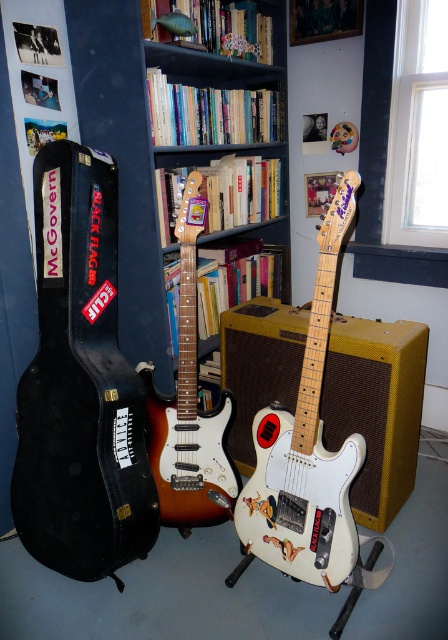
You are a GUI agent. You are given a task and a screenshot of the screen. Output one action in this format:
    pyautogui.click(x=<x>, y=<y>)
    Task: Click on the wooden bookcase at center
    
    Given the screenshot: What is the action you would take?
    pyautogui.click(x=151, y=145)

Is black matte guitar case at left shorter than wooden bookcase at center?

Indeed, black matte guitar case at left has a lesser height compared to wooden bookcase at center.

Which is behind, point (124, 460) or point (199, 152)?

Point (199, 152)

Find the location of a particular element. The height and width of the screenshot is (640, 448). black matte guitar case at left is located at coordinates (80, 385).

What are the coordinates of `black matte guitar case at left` in the screenshot? It's located at (80, 385).

Is black matte guitar case at left below sunburst wood electric guitar at center?

Indeed, black matte guitar case at left is positioned under sunburst wood electric guitar at center.

Between black matte guitar case at left and sunburst wood electric guitar at center, which one appears on the right side from the viewer's perspective?

Positioned to the right is sunburst wood electric guitar at center.

Does point (34, 230) come behind point (193, 518)?

No, it is not.

The height and width of the screenshot is (640, 448). What are the coordinates of `black matte guitar case at left` in the screenshot? It's located at (80, 385).